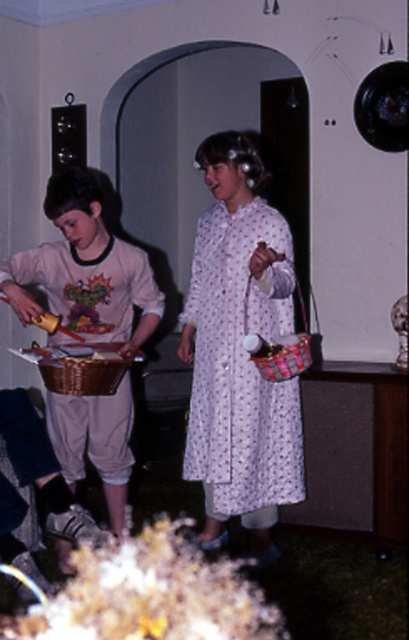
Looking at this image, you are a photographer trying to capture the white floral dress at center in the image. Based on the scene description, where should you position your camera to ensure the dress is in the frame?

The white floral dress at center is located at point (x=240, y=365), so position the camera to focus on that coordinate to include the dress in the frame.

You are a photographer trying to capture both the white floral dress at center and the light pink cotton dress at center in a single shot. Since you can only focus on one dress clearly, which one should you choose to ensure it appears sharp in the photo?

You should focus on the white floral dress at center because it is closer to the viewer, making it easier to capture sharply in the photo compared to the light pink cotton dress at center, which is farther away.